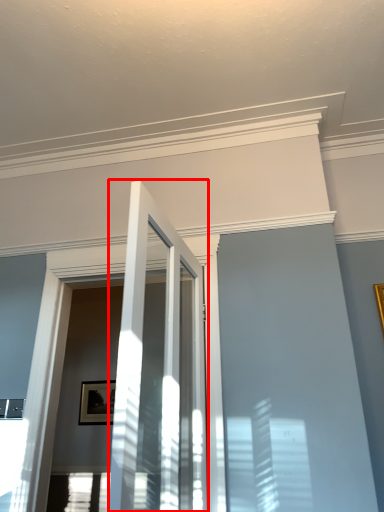
Question: Where is door (annotated by the red box) located in relation to picture frame in the image?

Choices:
 (A) left
 (B) right

Answer: (B)